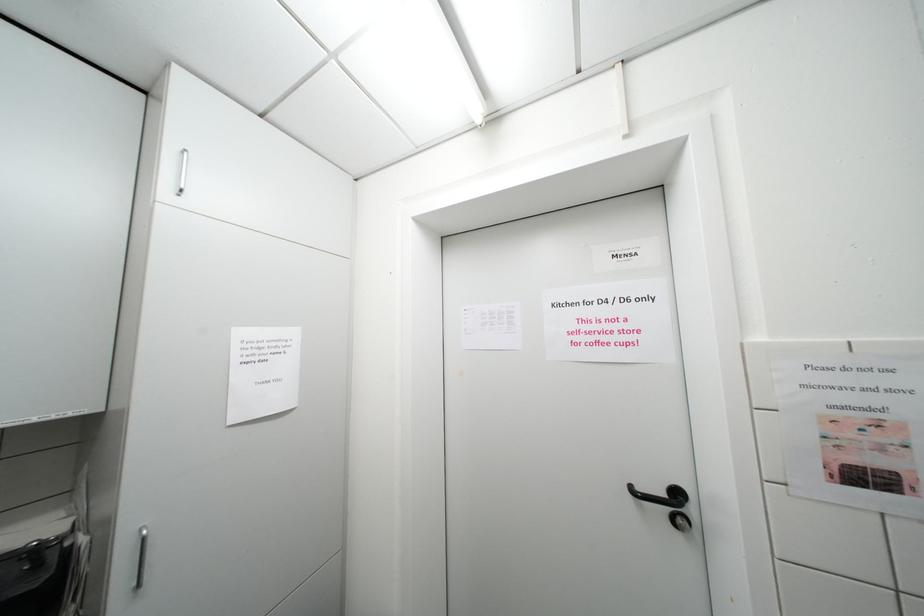
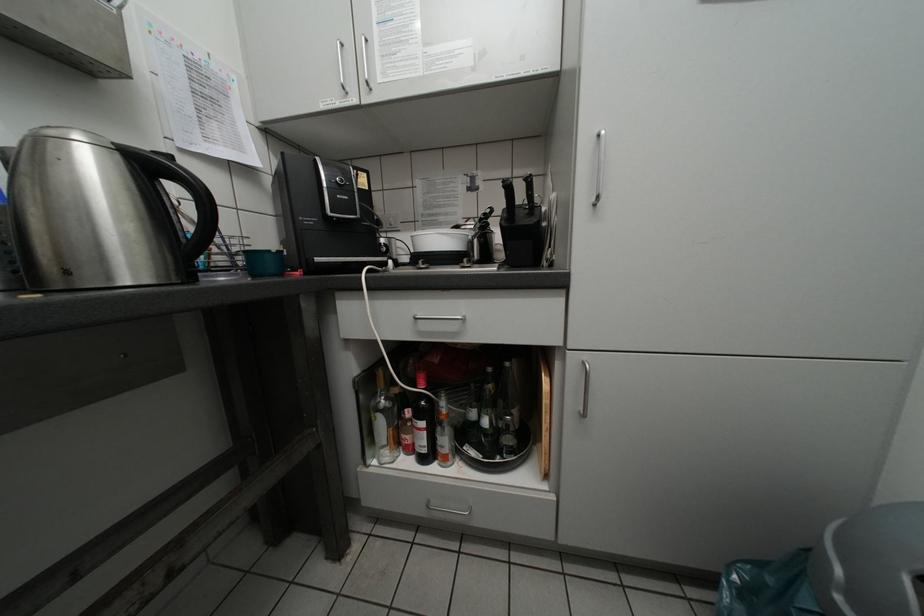
Question: The first image is from the beginning of the video and the second image is from the end. How did the camera likely rotate when shooting the video?

Choices:
 (A) Left
 (B) Right
 (C) Up
 (D) Down

Answer: (A)